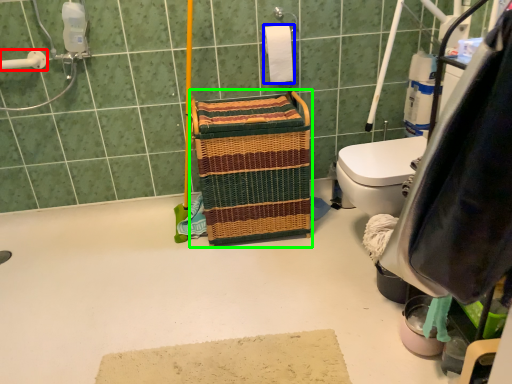
Question: Estimate the real-world distances between objects in this image. Which object is closer to shower (highlighted by a red box), toilet paper (highlighted by a blue box) or laundry basket (highlighted by a green box)?

Choices:
 (A) toilet paper
 (B) laundry basket

Answer: (B)